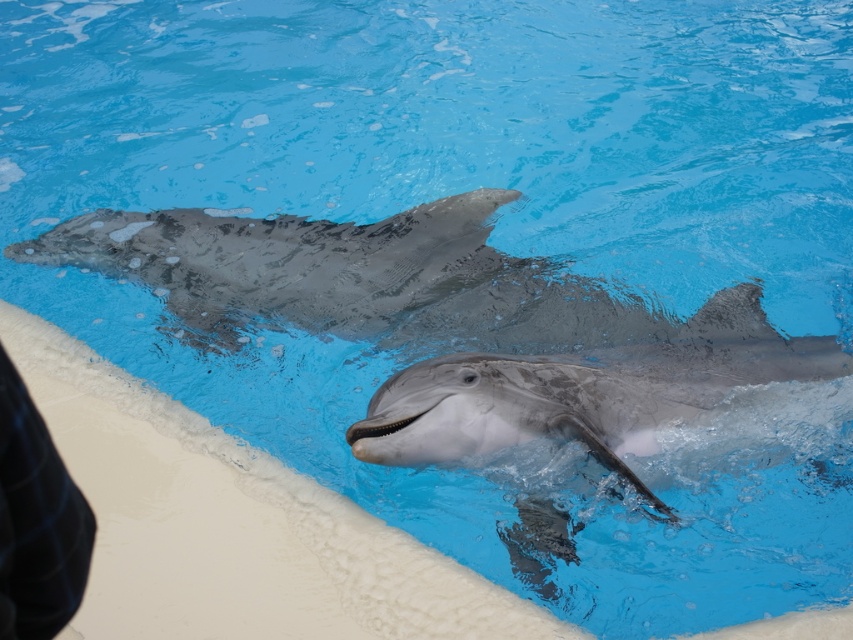
Question: Is smooth gray dolphin at center below black checkered fabric at lower left?

Choices:
 (A) yes
 (B) no

Answer: (A)

Question: Among these points, which one is nearest to the camera?

Choices:
 (A) (664, 353)
 (B) (62, 624)

Answer: (B)

Question: From the image, what is the correct spatial relationship of smooth gray dolphin at center in relation to black checkered fabric at lower left?

Choices:
 (A) below
 (B) above

Answer: (A)

Question: Which point is closer to the camera taking this photo?

Choices:
 (A) (3, 595)
 (B) (764, 324)

Answer: (A)

Question: Can you confirm if smooth gray dolphin at center is thinner than black checkered fabric at lower left?

Choices:
 (A) no
 (B) yes

Answer: (A)

Question: Which point is closer to the camera taking this photo?

Choices:
 (A) (4, 554)
 (B) (712, 451)

Answer: (A)